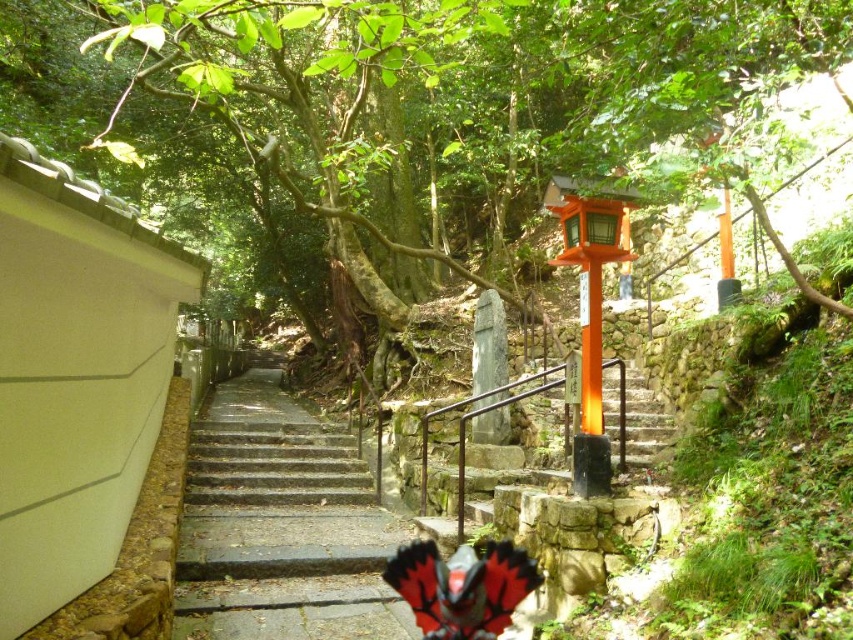
Which is more to the left, green leafy tree at center or orange matte/stained wood stairs at center?

Positioned to the left is green leafy tree at center.

What are the coordinates of `green leafy tree at center` in the screenshot? It's located at (407, 108).

Locate an element on the screen. green leafy tree at center is located at coordinates (407, 108).

Who is higher up, stone steps at center or orange matte/stained wood stairs at center?

orange matte/stained wood stairs at center

The width and height of the screenshot is (853, 640). Describe the element at coordinates (281, 525) in the screenshot. I see `stone steps at center` at that location.

Find the location of `stone steps at center`. stone steps at center is located at coordinates (281, 525).

Does green leafy tree at center appear on the left side of stone steps at center?

Correct, you'll find green leafy tree at center to the left of stone steps at center.

Is green leafy tree at center below stone steps at center?

Actually, green leafy tree at center is above stone steps at center.

Is point (444, 115) closer to viewer compared to point (396, 525)?

No, it is not.

Identify the location of green leafy tree at center. This screenshot has width=853, height=640. (407, 108).